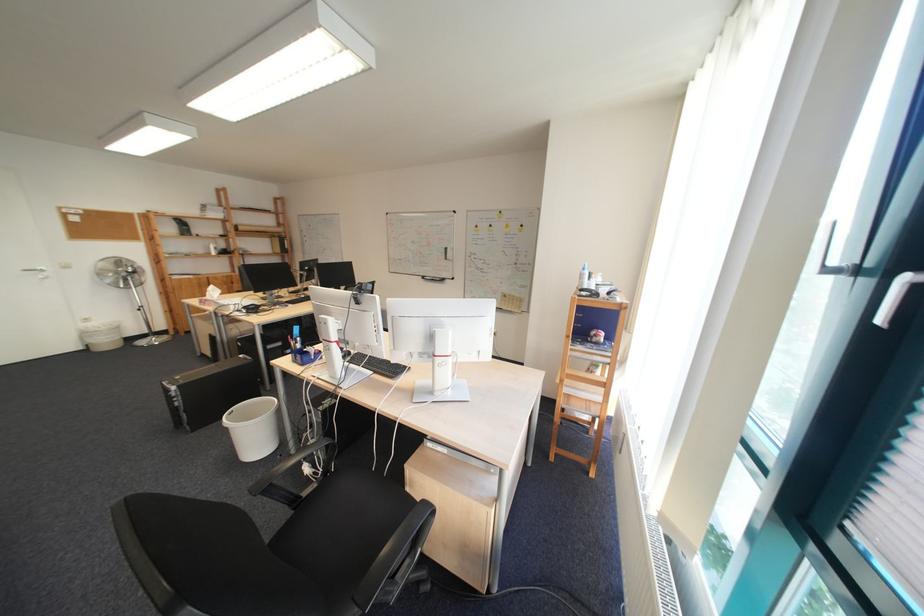
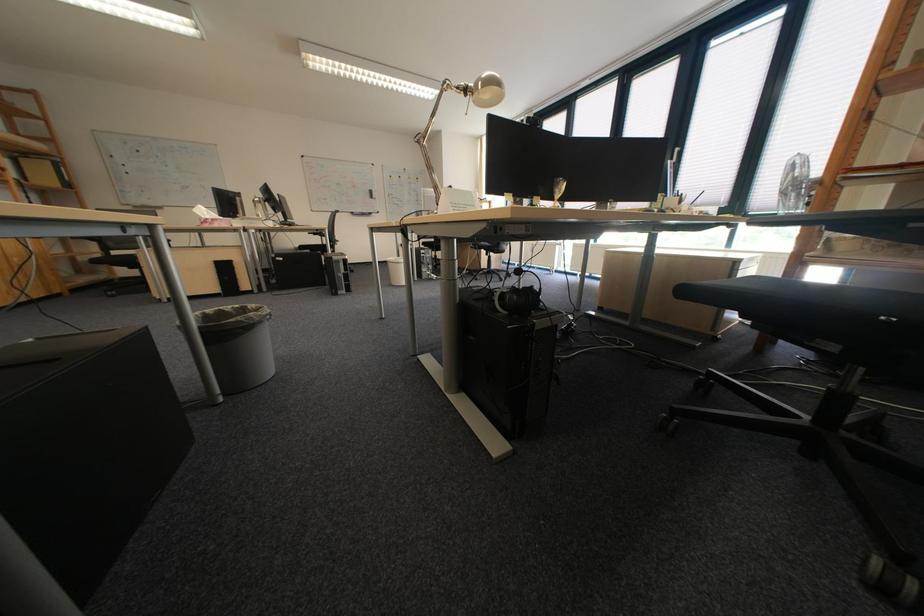
Question: I am providing you with two images of the same scene from different viewpoints. After the viewpoint changes to image2, which objects are now occluded?

Choices:
 (A) black headphones
 (B) empty glass jar
 (C) white tissue box
 (D) silver door handle

Answer: (D)